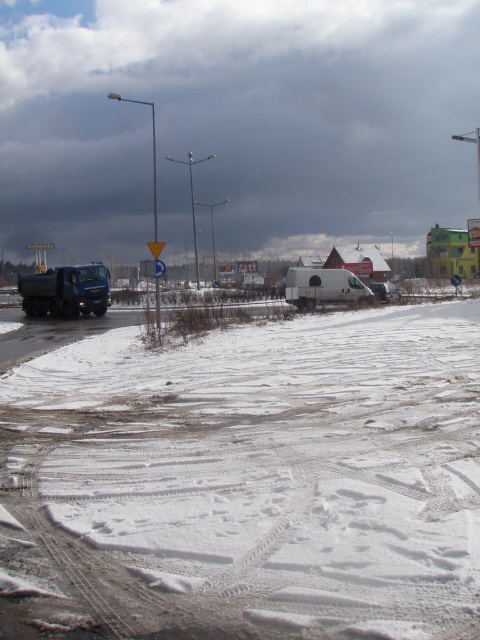
You are a delivery driver who needs to park your 5.5 meter long truck between the matte black truck at left and the white matte van at center. Is there enough space between them to park your truck without overlapping either vehicle?

The distance between the matte black truck at left and the white matte van at center is 21.36 meters. Since your truck is only 5.5 meters long, there is ample space to park between them without overlapping either vehicle.

You are a delivery driver who needs to park your vehicle on the snowy roadside. You see the white powdery snow at lower left and the matte black truck at left. Which location would be more suitable for parking your vehicle?

The white powdery snow at lower left is in front of the matte black truck at left, so parking there might block the truck or the truck might block your exit. A better option would be to park behind the matte black truck at left if possible, ensuring you have a clear path for departure.

You are a delivery driver who needs to turn around your vehicle. You see the matte black truck at left and the white matte van at center. Which vehicle is positioned closer to the left side of the road?

The matte black truck at left is positioned to the left of the white matte van at center, so it is closer to the left side of the road.